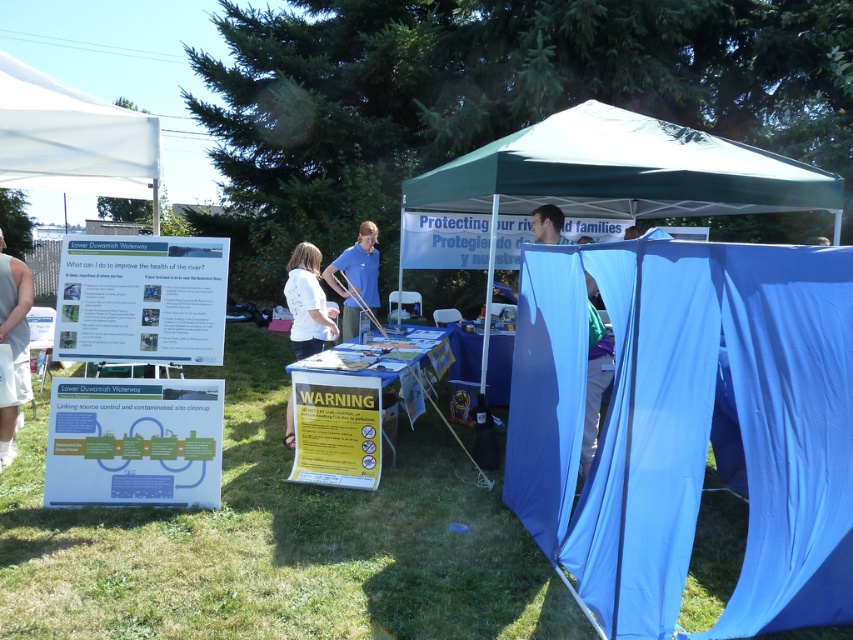
You are a visitor at the event and want to find the booth under the green canopy tent. You see the white fabric canopy at upper left and the blue smooth shirt at center. Which object is closer to the booth under the green canopy tent?

The blue smooth shirt at center is closer to the booth under the green canopy tent because the white fabric canopy at upper left is positioned over it, meaning the shirt is beneath the canopy.

You are a person who wants to place a 1.5 meter long banner between the green grass at lower left and the white fabric at left. Can you fit the banner horizontally between them without bending it?

The distance between the green grass at lower left and the white fabric at left is 1.66 meters. Since the banner is 1.5 meters long, it can fit horizontally between them without bending.